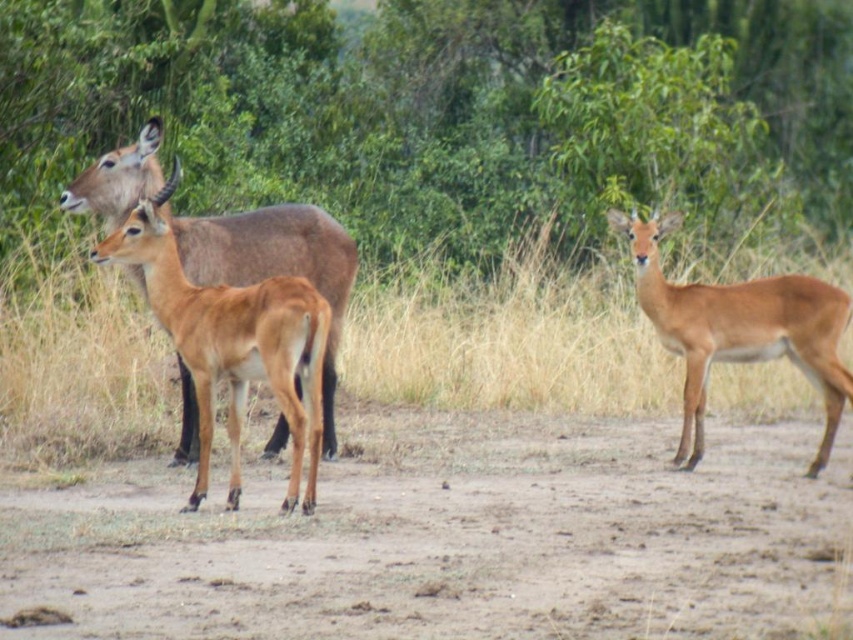
You are an animal tracker analyzing the image. You notice two points marked on the ground where the animals might have left tracks. The points are labeled as point 1 at coordinates point (779, 140) and point 2 at coordinates point (614, 376). Based on their positions, which point is closer to the observer?

Point (779, 140) is closer to the observer than point (614, 376) because it is further to the viewer.